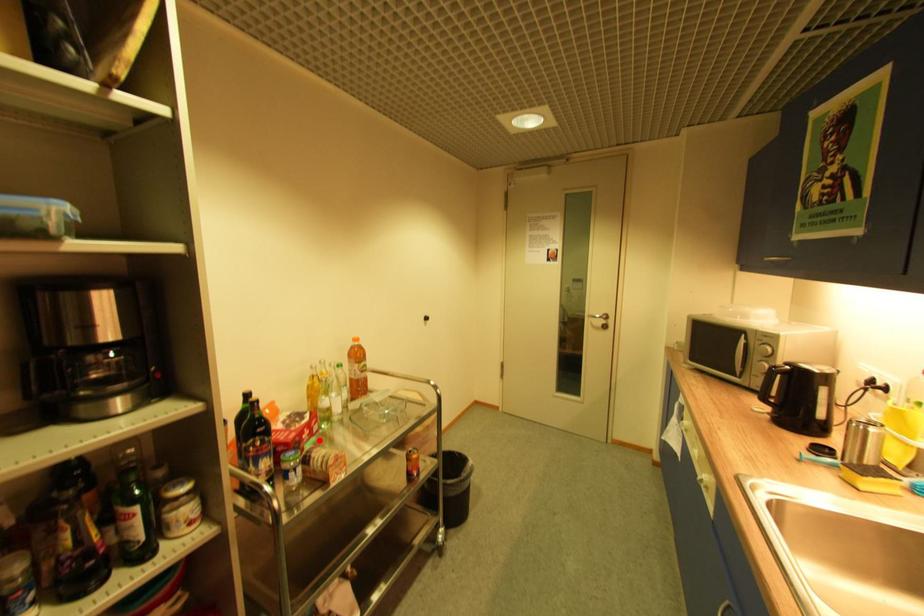
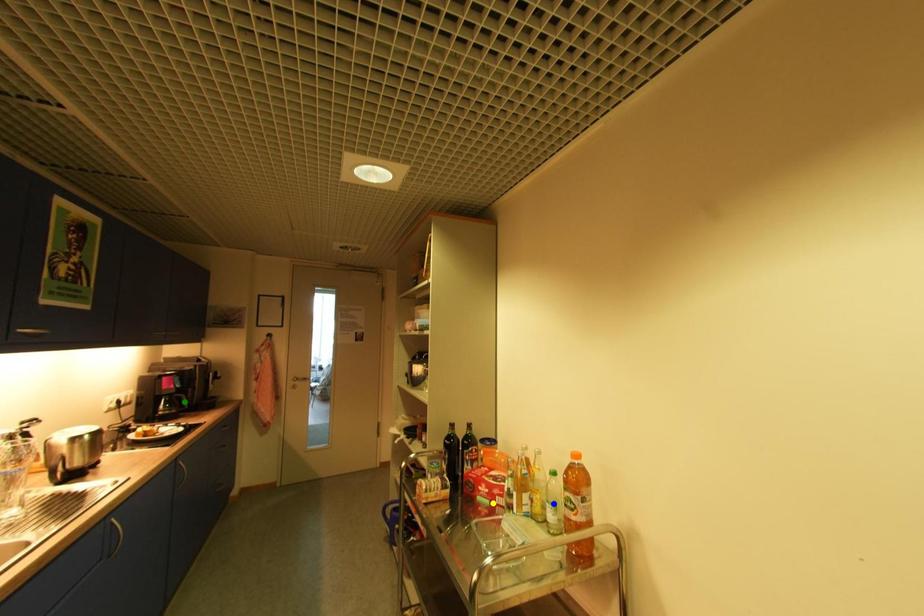
Question: I am providing you with two images of the same scene from different viewpoints. A red point is marked on the first image. You are given multiple points on the second image. Which mark in image 2 goes with the point in image 1?

Choices:
 (A) green point
 (B) blue point
 (C) yellow point

Answer: (C)